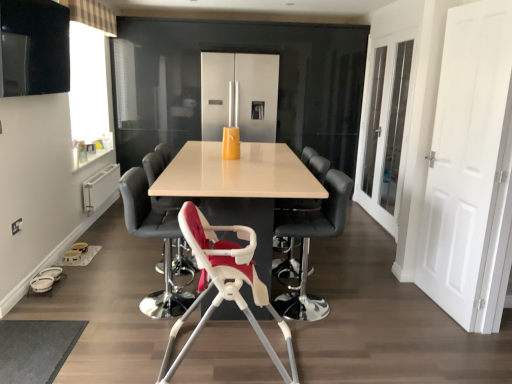
You are a GUI agent. You are given a task and a screenshot of the screen. Output one action in this format:
    pyautogui.click(x=<x>, y=<y>)
    Task: Click on the vacant space in white plastic highchair at center, the fifth chair when ordered from back to front (from a real-world perspective)
    This screenshot has height=384, width=512.
    Given the screenshot: What is the action you would take?
    click(239, 364)